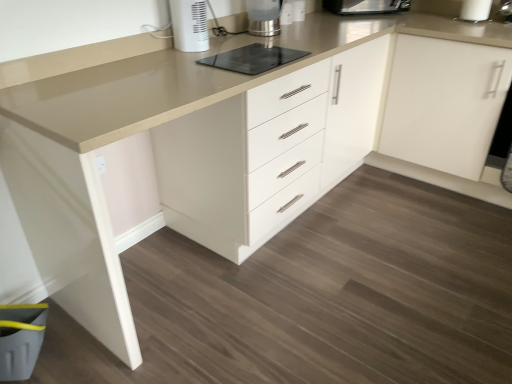
What do you see at coordinates (189, 25) in the screenshot? This screenshot has width=512, height=384. I see `white plastic heater at upper center, which is counted as the first home appliance, starting from the left` at bounding box center [189, 25].

Measure the distance between white matte cabinet at upper right and camera.

The distance of white matte cabinet at upper right from camera is 6.67 feet.

Where is `white plastic heater at upper center, acting as the 2th home appliance starting from the right`? The height and width of the screenshot is (384, 512). white plastic heater at upper center, acting as the 2th home appliance starting from the right is located at coordinates (189, 25).

Is black glass cooktop at center to the left or to the right of metallic stainless steel toaster at upper center in the image?

From the image, it's evident that black glass cooktop at center is to the left of metallic stainless steel toaster at upper center.

Considering the sizes of black glass cooktop at center and metallic stainless steel toaster at upper center in the image, is black glass cooktop at center wider or thinner than metallic stainless steel toaster at upper center?

black glass cooktop at center is thinner than metallic stainless steel toaster at upper center.

Which object is further away from the camera taking this photo, black glass cooktop at center or metallic stainless steel toaster at upper center?

Positioned behind is metallic stainless steel toaster at upper center.

Is metallic silver kettle at upper center, the first home appliance positioned from the back, oriented towards metallic stainless steel toaster at upper center?

No, metallic silver kettle at upper center, the first home appliance positioned from the back, is not oriented towards metallic stainless steel toaster at upper center.

The image size is (512, 384). There is a metallic stainless steel toaster at upper center. In order to click on the 1st home appliance below it (from the image's perspective) in this screenshot , I will do `click(264, 17)`.

Is metallic stainless steel toaster at upper center a part of metallic silver kettle at upper center, the first home appliance in the right-to-left sequence?

Actually, metallic stainless steel toaster at upper center is outside metallic silver kettle at upper center, the first home appliance in the right-to-left sequence.

Does metallic silver kettle at upper center, which is the 2th home appliance from left to right, contain white matte cabinet at upper right?

That's incorrect, white matte cabinet at upper right is not inside metallic silver kettle at upper center, which is the 2th home appliance from left to right.

Is point (251, 23) less distant than point (388, 134)?

Yes.

Looking at this image, from the image's perspective, does metallic silver kettle at upper center, the first home appliance positioned from the back, appear lower than white matte cabinet at upper right?

No.

Find the location of a particular element. This screenshot has height=384, width=512. cabinetry in front of the metallic silver kettle at upper center, the first home appliance in the right-to-left sequence is located at coordinates (444, 103).

From the image's perspective, is black glass cooktop at center on top of white matte cabinet at upper right?

Yes, from the image's perspective, black glass cooktop at center is above white matte cabinet at upper right.

From the picture: Considering the sizes of black glass cooktop at center and white matte cabinet at upper right in the image, is black glass cooktop at center taller or shorter than white matte cabinet at upper right?

Clearly, black glass cooktop at center is shorter compared to white matte cabinet at upper right.

Identify the location of appliance lying above the white matte cabinet at upper right (from the image's perspective). click(253, 59).

Is black glass cooktop at center oriented towards white matte cabinet at upper right?

No, black glass cooktop at center is not oriented towards white matte cabinet at upper right.

Is metallic stainless steel toaster at upper center wider than metallic silver kettle at upper center, the first home appliance positioned from the back?

Yes, metallic stainless steel toaster at upper center is wider than metallic silver kettle at upper center, the first home appliance positioned from the back.

Who is smaller, metallic stainless steel toaster at upper center or metallic silver kettle at upper center, the first home appliance positioned from the back?

Smaller between the two is metallic silver kettle at upper center, the first home appliance positioned from the back.

Does point (376, 8) come in front of point (279, 3)?

No, (376, 8) is behind (279, 3).

Would you say metallic stainless steel toaster at upper center is inside or outside metallic silver kettle at upper center, which is the second home appliance from front to back?

metallic stainless steel toaster at upper center exists outside the volume of metallic silver kettle at upper center, which is the second home appliance from front to back.

Is white plastic heater at upper center, arranged as the second home appliance when viewed from the back, not inside white matte cabinet at upper right?

Yes, white plastic heater at upper center, arranged as the second home appliance when viewed from the back, is not within white matte cabinet at upper right.

From the image's perspective, is white plastic heater at upper center, which is counted as the first home appliance, starting from the left, above or below white matte cabinet at upper right?

white plastic heater at upper center, which is counted as the first home appliance, starting from the left, is situated higher than white matte cabinet at upper right in the image.

Does white plastic heater at upper center, which is counted as the first home appliance, starting from the left, have a greater width compared to white matte cabinet at upper right?

In fact, white plastic heater at upper center, which is counted as the first home appliance, starting from the left, might be narrower than white matte cabinet at upper right.

What's the angular difference between white plastic heater at upper center, the 1th home appliance in the front-to-back sequence, and white matte cabinet at upper right's facing directions?

The angular difference between white plastic heater at upper center, the 1th home appliance in the front-to-back sequence, and white matte cabinet at upper right is 91.3 degrees.

Can you confirm if white matte cabinet at upper right is smaller than white plastic heater at upper center, acting as the 2th home appliance starting from the right?

No, white matte cabinet at upper right is not smaller than white plastic heater at upper center, acting as the 2th home appliance starting from the right.

Is white matte cabinet at upper right taller or shorter than white plastic heater at upper center, acting as the 2th home appliance starting from the right?

In the image, white matte cabinet at upper right appears to be taller than white plastic heater at upper center, acting as the 2th home appliance starting from the right.

From the image's perspective, which one is positioned higher, white matte cabinet at upper right or white plastic heater at upper center, the 1th home appliance in the front-to-back sequence?

white plastic heater at upper center, the 1th home appliance in the front-to-back sequence, from the image's perspective.

In the image, there is a black glass cooktop at center. Identify the location of kitchen appliance above it (from the image's perspective). The width and height of the screenshot is (512, 384). (366, 6).

Find the location of a particular element. kitchen appliance directly beneath the metallic silver kettle at upper center, which is the 2th home appliance from left to right (from a real-world perspective) is located at coordinates (366, 6).

Based on their spatial positions, is metallic stainless steel toaster at upper center or metallic silver kettle at upper center, the first home appliance positioned from the back, closer to black glass cooktop at center?

metallic silver kettle at upper center, the first home appliance positioned from the back, lies closer to black glass cooktop at center than the other object.

Considering their positions, is black glass cooktop at center positioned further to white plastic heater at upper center, the 1th home appliance in the front-to-back sequence, than metallic stainless steel toaster at upper center?

metallic stainless steel toaster at upper center lies further to white plastic heater at upper center, the 1th home appliance in the front-to-back sequence, than the other object.

Considering their positions, is white plastic heater at upper center, which is counted as the first home appliance, starting from the left, positioned closer to black glass cooktop at center than metallic silver kettle at upper center, which is the second home appliance from front to back?

Among the two, white plastic heater at upper center, which is counted as the first home appliance, starting from the left, is located nearer to black glass cooktop at center.

Estimate the real-world distances between objects in this image. Which object is closer to metallic silver kettle at upper center, which is the second home appliance from front to back, white plastic heater at upper center, arranged as the second home appliance when viewed from the back, or metallic stainless steel toaster at upper center?

white plastic heater at upper center, arranged as the second home appliance when viewed from the back, is closer to metallic silver kettle at upper center, which is the second home appliance from front to back.

When comparing their distances from black glass cooktop at center, does white plastic heater at upper center, arranged as the second home appliance when viewed from the back, or metallic stainless steel toaster at upper center seem closer?

white plastic heater at upper center, arranged as the second home appliance when viewed from the back.

When comparing their distances from black glass cooktop at center, does metallic stainless steel toaster at upper center or white plastic heater at upper center, arranged as the second home appliance when viewed from the back, seem further?

Among the two, metallic stainless steel toaster at upper center is located further to black glass cooktop at center.

Which object lies further to the anchor point metallic silver kettle at upper center, which is the second home appliance from front to back, black glass cooktop at center or white plastic heater at upper center, the 1th home appliance in the front-to-back sequence?

black glass cooktop at center.

When comparing their distances from metallic silver kettle at upper center, which is the 2th home appliance from left to right, does white plastic heater at upper center, acting as the 2th home appliance starting from the right, or white matte cabinet at upper right seem closer?

white plastic heater at upper center, acting as the 2th home appliance starting from the right, is closer to metallic silver kettle at upper center, which is the 2th home appliance from left to right.

Locate an element on the screen. home appliance between white plastic heater at upper center, which is counted as the first home appliance, starting from the left, and white matte cabinet at upper right, in the horizontal direction is located at coordinates (264, 17).

I want to click on kitchen appliance between metallic silver kettle at upper center, the first home appliance positioned from the back, and white matte cabinet at upper right, so click(366, 6).

In order to click on appliance located between white plastic heater at upper center, the 1th home appliance in the front-to-back sequence, and white matte cabinet at upper right in the left-right direction in this screenshot , I will do `click(253, 59)`.

Locate an element on the screen. This screenshot has width=512, height=384. home appliance between black glass cooktop at center and metallic silver kettle at upper center, the first home appliance in the right-to-left sequence, in the front-back direction is located at coordinates (189, 25).